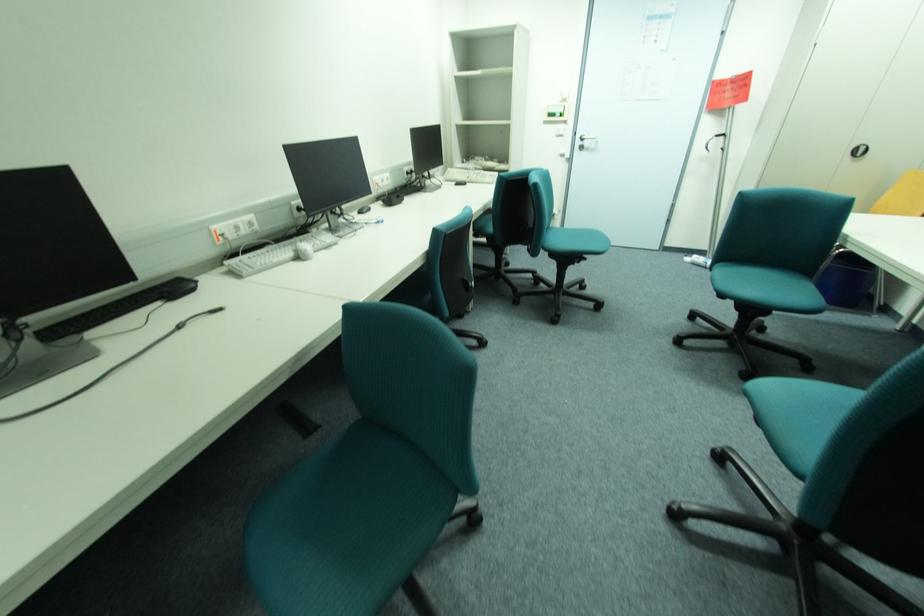
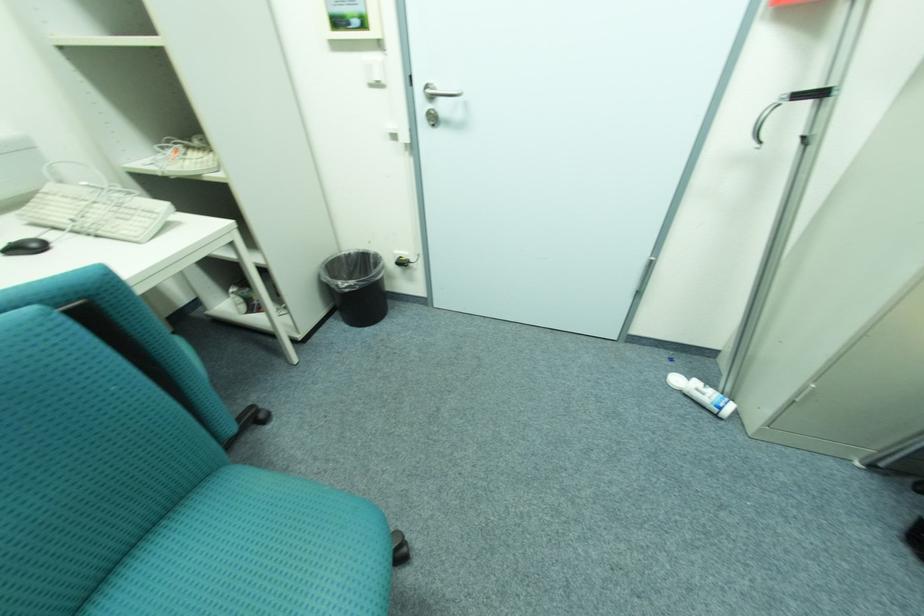
The images are taken continuously from a first-person perspective. In which direction are you moving?

The cameraman walked toward right, forward.